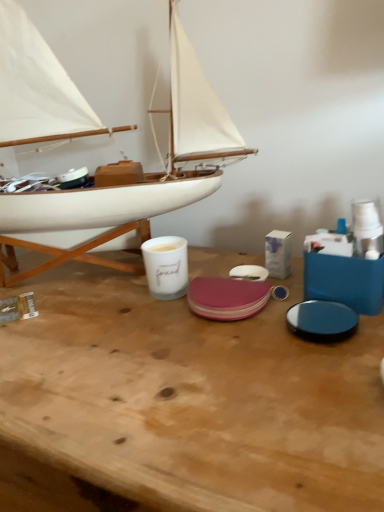
Question: Should I look upward or downward to see white wood boat at left?

Choices:
 (A) up
 (B) down

Answer: (A)

Question: Is white ceramic mug at center oriented towards white wood boat at left?

Choices:
 (A) yes
 (B) no

Answer: (A)

Question: Is the surface of white ceramic mug at center in direct contact with white wood boat at left?

Choices:
 (A) no
 (B) yes

Answer: (A)

Question: From a real-world perspective, does white ceramic mug at center stand above white wood boat at left?

Choices:
 (A) no
 (B) yes

Answer: (A)

Question: Is the depth of white ceramic mug at center greater than that of white wood boat at left?

Choices:
 (A) no
 (B) yes

Answer: (B)

Question: Considering the relative sizes of white ceramic mug at center and white wood boat at left in the image provided, is white ceramic mug at center bigger than white wood boat at left?

Choices:
 (A) no
 (B) yes

Answer: (A)

Question: Considering the relative sizes of white ceramic mug at center and white wood boat at left in the image provided, is white ceramic mug at center smaller than white wood boat at left?

Choices:
 (A) no
 (B) yes

Answer: (B)

Question: Can you confirm if white wood boat at left is shorter than wooden table at center?

Choices:
 (A) no
 (B) yes

Answer: (A)

Question: Can we say white wood boat at left lies outside wooden table at center?

Choices:
 (A) yes
 (B) no

Answer: (A)

Question: Is white wood boat at left oriented away from wooden table at center?

Choices:
 (A) no
 (B) yes

Answer: (A)

Question: Would you say wooden table at center is part of white wood boat at left's contents?

Choices:
 (A) yes
 (B) no

Answer: (B)

Question: Does white wood boat at left have a greater width compared to wooden table at center?

Choices:
 (A) no
 (B) yes

Answer: (A)

Question: From the image's perspective, is white wood boat at left beneath wooden table at center?

Choices:
 (A) yes
 (B) no

Answer: (B)

Question: Does wooden table at center have a greater width compared to white wood boat at left?

Choices:
 (A) no
 (B) yes

Answer: (B)